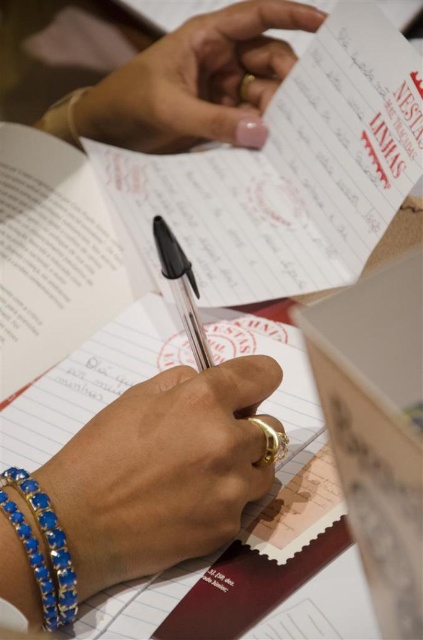
Question: Is gold ring at center positioned before blue crystal bracelet at lower left?

Choices:
 (A) no
 (B) yes

Answer: (A)

Question: Observing the image, what is the correct spatial positioning of blue crystal bracelet at lower left in reference to black plastic pen at center?

Choices:
 (A) right
 (B) left

Answer: (B)

Question: Which of these objects is positioned closest to the pink polished nails at upper center?

Choices:
 (A) blue crystal bracelet at lower left
 (B) gold ring at center

Answer: (B)

Question: Is the position of gold ring at center more distant than that of black plastic pen at center?

Choices:
 (A) yes
 (B) no

Answer: (B)

Question: Which of the following is the closest to the observer?

Choices:
 (A) gold ring at center
 (B) blue crystal bracelet at lower left

Answer: (B)

Question: Which of these objects is positioned closest to the black plastic pen at center?

Choices:
 (A) pink polished nails at upper center
 (B) blue crystal bracelet at lower left

Answer: (B)